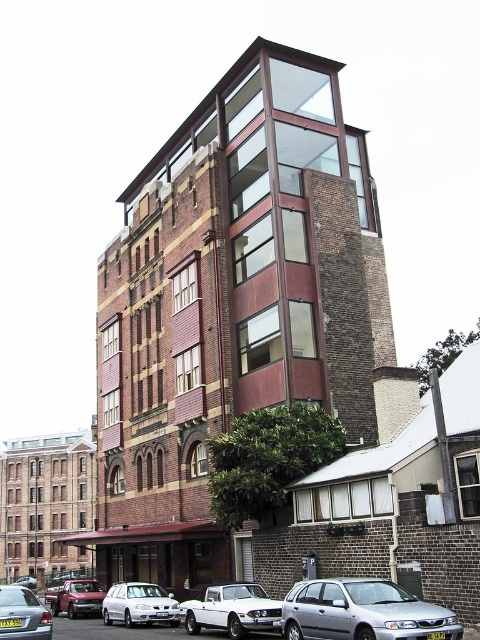
Is silver metallic sedan at lower center taller than silver metallic sedan at lower left?

Indeed, silver metallic sedan at lower center has a greater height compared to silver metallic sedan at lower left.

In the scene shown: Does silver metallic sedan at lower center have a lesser width compared to silver metallic sedan at lower left?

No, silver metallic sedan at lower center is not thinner than silver metallic sedan at lower left.

Does point (400, 609) come in front of point (4, 627)?

Yes.

Where is `silver metallic sedan at lower center`? silver metallic sedan at lower center is located at coordinates (362, 612).

Who is positioned more to the right, white glossy pickup truck at lower center or metallic silver sedan at lower left?

Positioned to the right is white glossy pickup truck at lower center.

Can you confirm if white glossy pickup truck at lower center is wider than metallic silver sedan at lower left?

Incorrect, white glossy pickup truck at lower center's width does not surpass metallic silver sedan at lower left's.

Who is more distant from viewer, [271,600] or [81,592]?

The point [81,592] is behind.

Where is `white glossy pickup truck at lower center`? The image size is (480, 640). white glossy pickup truck at lower center is located at coordinates (231, 609).

Is point (260, 627) closer to viewer compared to point (156, 593)?

Yes.

Does point (228, 592) come closer to viewer compared to point (171, 625)?

Yes, point (228, 592) is closer to viewer.

Identify the location of white glossy pickup truck at lower center. The height and width of the screenshot is (640, 480). (231, 609).